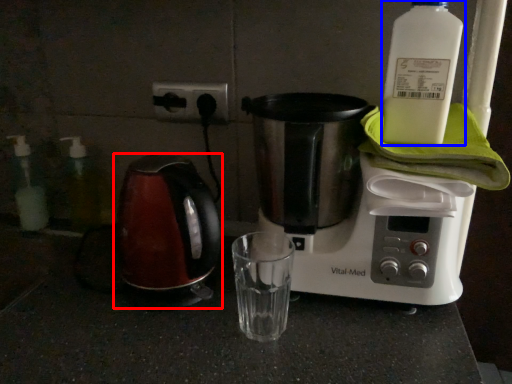
Question: Among these objects, which one is farthest to the camera, kettle (highlighted by a red box) or bottle (highlighted by a blue box)?

Choices:
 (A) kettle
 (B) bottle

Answer: (A)